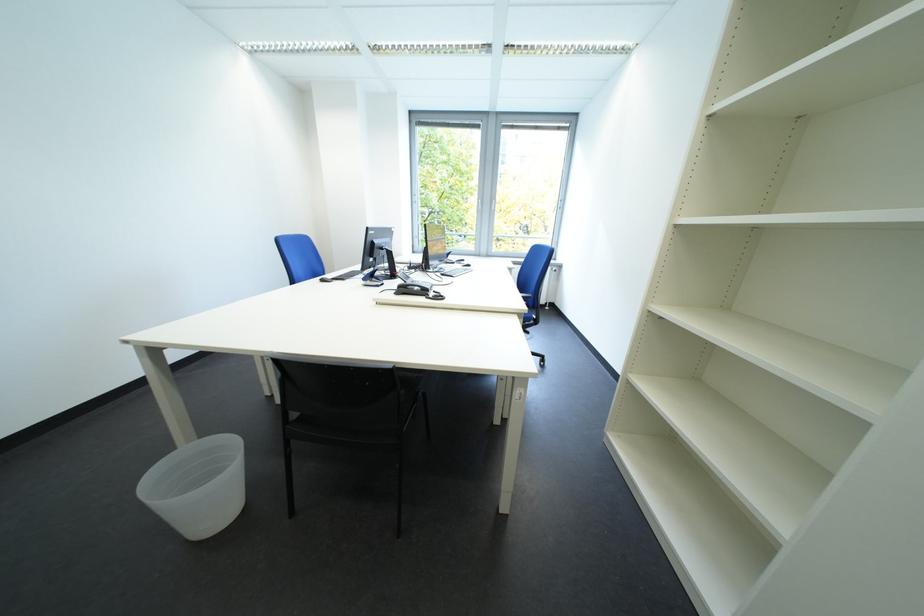
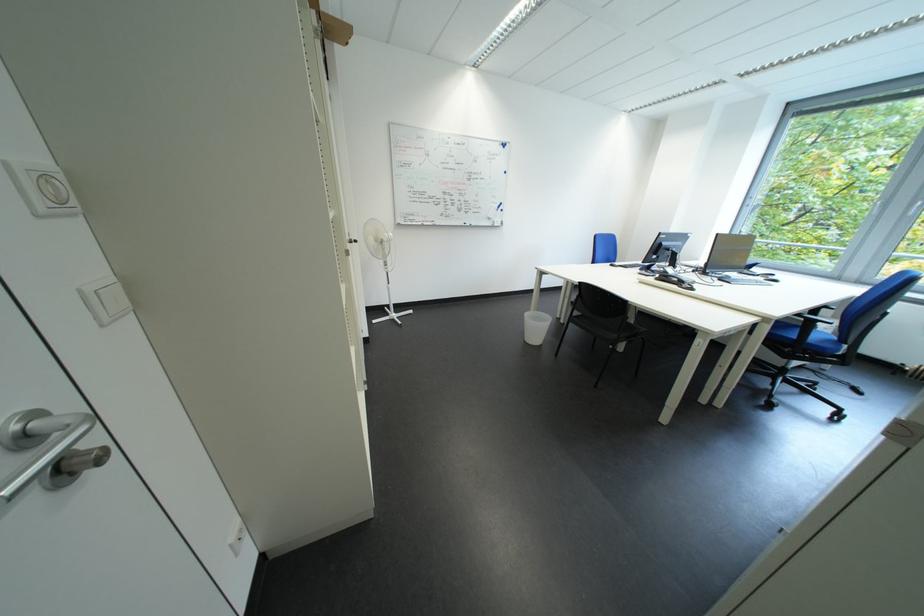
The point at (162, 484) is marked in the first image. Where is the corresponding point in the second image?

(540, 317)